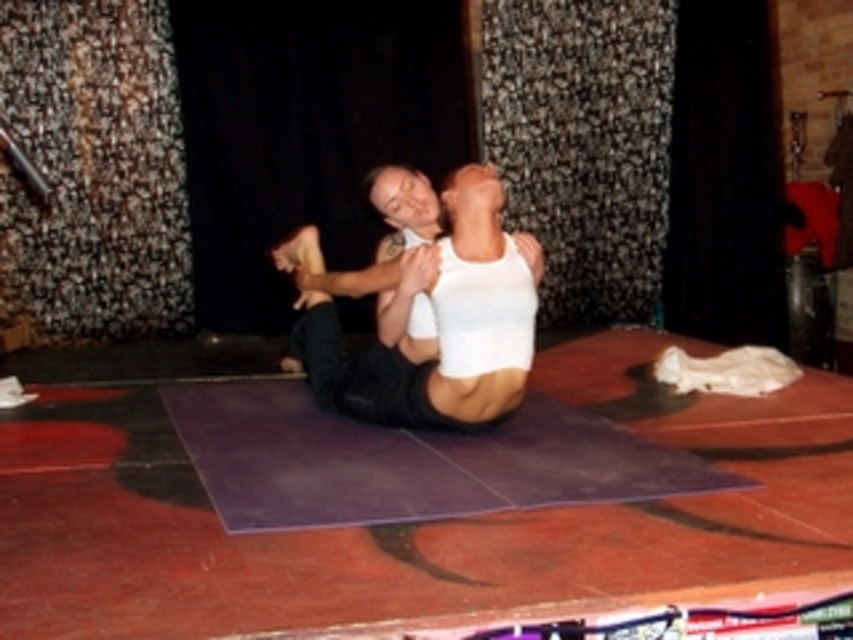
Who is more forward, (454,483) or (415,285)?

Point (454,483)

Identify the location of purple rubber mat at center. (409, 460).